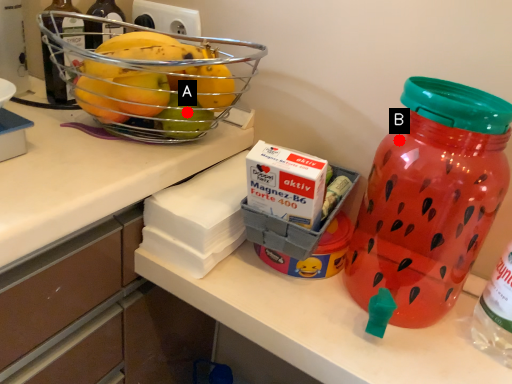
Question: Two points are circled on the image, labeled by A and B beside each circle. Which point is farther to the camera?

Choices:
 (A) A is further
 (B) B is further

Answer: (B)